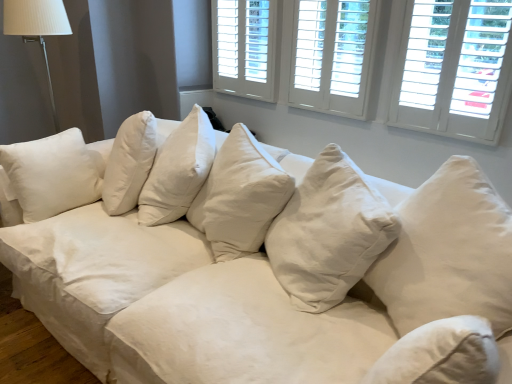
Locate an element on the screen. beige cotton pillow at center is located at coordinates (449, 252).

Identify the location of white wood shutters at upper right, arranged as the third window when viewed from the left. The width and height of the screenshot is (512, 384). (454, 69).

This screenshot has height=384, width=512. Describe the element at coordinates (37, 28) in the screenshot. I see `white fabric lampshade at upper left` at that location.

The height and width of the screenshot is (384, 512). Identify the location of white fabric lampshade at upper left. (37, 28).

Locate an element on the screen. This screenshot has width=512, height=384. white wood shutters at upper center, which appears as the third window when viewed from the right is located at coordinates (245, 47).

You are a GUI agent. You are given a task and a screenshot of the screen. Output one action in this format:
    pyautogui.click(x=<x>, y=<y>)
    Task: Click on the beige cotton pillow at center
    
    Given the screenshot: What is the action you would take?
    pyautogui.click(x=449, y=252)

From a real-world perspective, between white cotton couch at center and beige cotton pillow at center, who is vertically lower?

white cotton couch at center, from a real-world perspective.

Is white cotton couch at center in front of or behind beige cotton pillow at center in the image?

white cotton couch at center is positioned closer to the viewer than beige cotton pillow at center.

Is white cotton couch at center inside the boundaries of beige cotton pillow at center, or outside?

The correct answer is: outside.

In the scene shown: Is white wood shutters at upper right, arranged as the third window when viewed from the left, situated inside beige cotton pillow at center or outside?

white wood shutters at upper right, arranged as the third window when viewed from the left, is located beyond the bounds of beige cotton pillow at center.

Considering the sizes of white wood shutters at upper right, arranged as the 1th window when viewed from the right, and beige cotton pillow at center in the image, is white wood shutters at upper right, arranged as the 1th window when viewed from the right, bigger or smaller than beige cotton pillow at center?

Considering their sizes, white wood shutters at upper right, arranged as the 1th window when viewed from the right, takes up less space than beige cotton pillow at center.

Looking at this image, considering the sizes of white cotton couch at center and white wood shutters at upper right, arranged as the 1th window when viewed from the right, in the image, is white cotton couch at center wider or thinner than white wood shutters at upper right, arranged as the 1th window when viewed from the right,?

In the image, white cotton couch at center appears to be wider than white wood shutters at upper right, arranged as the 1th window when viewed from the right.

How different are the orientations of white cotton couch at center and white wood shutters at upper right, arranged as the 1th window when viewed from the right, in degrees?

The angular difference between white cotton couch at center and white wood shutters at upper right, arranged as the 1th window when viewed from the right, is 4.36 degrees.

From a real-world perspective, is white cotton couch at center physically located above or below white wood shutters at upper right, arranged as the third window when viewed from the left?

From a real-world perspective, white cotton couch at center is physically below white wood shutters at upper right, arranged as the third window when viewed from the left.

Does point (216, 178) come behind point (453, 91)?

No, (216, 178) is closer to viewer.

From the picture: Considering the sizes of beige cotton pillow at center and white fabric lampshade at upper left in the image, is beige cotton pillow at center taller or shorter than white fabric lampshade at upper left?

Considering their sizes, beige cotton pillow at center has less height than white fabric lampshade at upper left.

Is beige cotton pillow at center bigger or smaller than white fabric lampshade at upper left?

Clearly, beige cotton pillow at center is larger in size than white fabric lampshade at upper left.

Image resolution: width=512 pixels, height=384 pixels. What are the coordinates of `table lamp that appears above the beige cotton pillow at center (from the image's perspective)` in the screenshot? It's located at (37, 28).

Can you tell me how much beige cotton pillow at center and white fabric lampshade at upper left differ in facing direction?

beige cotton pillow at center and white fabric lampshade at upper left are facing 30.3 degrees away from each other.

Locate an element on the screen. This screenshot has height=384, width=512. pillow in front of the white wood window at upper center, the 2th window positioned from the left is located at coordinates (449, 252).

Looking at this image, is white wood window at upper center, the second window from the right, positioned behind beige cotton pillow at center?

Yes, white wood window at upper center, the second window from the right, is further from the viewer.

Considering the sizes of white wood window at upper center, the 2th window positioned from the left, and beige cotton pillow at center in the image, is white wood window at upper center, the 2th window positioned from the left, taller or shorter than beige cotton pillow at center?

Clearly, white wood window at upper center, the 2th window positioned from the left, is shorter compared to beige cotton pillow at center.

Can you tell me how much white wood window at upper center, the second window from the right, and beige cotton pillow at center differ in facing direction?

The facing directions of white wood window at upper center, the second window from the right, and beige cotton pillow at center are 31.1 degrees apart.

Between white cotton couch at center and white wood window at upper center, the second window from the right, which one has less height?

With less height is white wood window at upper center, the second window from the right.

Is white cotton couch at center not within white wood window at upper center, the 2th window positioned from the left?

white cotton couch at center lies outside white wood window at upper center, the 2th window positioned from the left,'s area.

Is the surface of white cotton couch at center in direct contact with white wood window at upper center, the second window from the right?

No.

Which window is the 1st one when counting from the back of the white wood shutters at upper right, arranged as the third window when viewed from the left? Please provide its 2D coordinates.

[(333, 55)]

Looking at their sizes, would you say white wood shutters at upper right, arranged as the 1th window when viewed from the right, is wider or thinner than white wood window at upper center, the second window from the right?

white wood shutters at upper right, arranged as the 1th window when viewed from the right, is wider than white wood window at upper center, the second window from the right.

Is white wood shutters at upper right, arranged as the third window when viewed from the left, to the left of white wood window at upper center, the second window from the right, from the viewer's perspective?

No, white wood shutters at upper right, arranged as the third window when viewed from the left, is not to the left of white wood window at upper center, the second window from the right.

Can you tell me how much white wood shutters at upper right, arranged as the third window when viewed from the left, and white wood window at upper center, the 2th window positioned from the left, differ in facing direction?

There is a 3.51-degree angle between the facing directions of white wood shutters at upper right, arranged as the third window when viewed from the left, and white wood window at upper center, the 2th window positioned from the left.

Where is `pillow that appears behind the white cotton couch at center`? pillow that appears behind the white cotton couch at center is located at coordinates (449, 252).

Where is `pillow located underneath the white wood shutters at upper right, arranged as the 1th window when viewed from the right (from a real-world perspective)`? The image size is (512, 384). pillow located underneath the white wood shutters at upper right, arranged as the 1th window when viewed from the right (from a real-world perspective) is located at coordinates (449, 252).

Based on their spatial positions, is white wood window at upper center, the second window from the right, or white cotton couch at center closer to white wood shutters at upper center, which appears as the third window when viewed from the right?

white wood window at upper center, the second window from the right, is closer to white wood shutters at upper center, which appears as the third window when viewed from the right.

Estimate the real-world distances between objects in this image. Which object is closer to white cotton couch at center, beige cotton pillow at center or white wood shutters at upper right, arranged as the 1th window when viewed from the right?

Among the two, beige cotton pillow at center is located nearer to white cotton couch at center.

When comparing their distances from white fabric lampshade at upper left, does white wood window at upper center, the second window from the right, or white wood shutters at upper right, arranged as the 1th window when viewed from the right, seem closer?

white wood window at upper center, the second window from the right, is closer to white fabric lampshade at upper left.

From the image, which object appears to be nearer to white wood window at upper center, the 2th window positioned from the left, white fabric lampshade at upper left or white wood shutters at upper right, arranged as the third window when viewed from the left?

Based on the image, white wood shutters at upper right, arranged as the third window when viewed from the left, appears to be nearer to white wood window at upper center, the 2th window positioned from the left.

From the image, which object appears to be nearer to white wood window at upper center, the 2th window positioned from the left, beige cotton pillow at center or white wood shutters at upper center, which appears as the third window when viewed from the right?

white wood shutters at upper center, which appears as the third window when viewed from the right, is positioned closer to the anchor white wood window at upper center, the 2th window positioned from the left.

From the image, which object appears to be nearer to white cotton couch at center, white wood shutters at upper right, arranged as the third window when viewed from the left, or white wood window at upper center, the second window from the right?

white wood window at upper center, the second window from the right.

From the image, which object appears to be farther from white fabric lampshade at upper left, white wood shutters at upper center, placed as the 1th window when sorted from left to right, or beige cotton pillow at center?

Based on the image, beige cotton pillow at center appears to be further to white fabric lampshade at upper left.

Which object lies further to the anchor point white fabric lampshade at upper left, white wood window at upper center, the 2th window positioned from the left, or white wood shutters at upper center, which appears as the third window when viewed from the right?

white wood window at upper center, the 2th window positioned from the left.

Image resolution: width=512 pixels, height=384 pixels. I want to click on studio couch between white fabric lampshade at upper left and beige cotton pillow at center from left to right, so click(x=252, y=260).

You are a GUI agent. You are given a task and a screenshot of the screen. Output one action in this format:
    pyautogui.click(x=<x>, y=<y>)
    Task: Click on the window between white fabric lampshade at upper left and white wood window at upper center, the 2th window positioned from the left
    The image size is (512, 384).
    Given the screenshot: What is the action you would take?
    pyautogui.click(x=245, y=47)

Find the location of a particular element. The image size is (512, 384). pillow located between white cotton couch at center and white wood shutters at upper center, which appears as the third window when viewed from the right, in the depth direction is located at coordinates (449, 252).

You are a GUI agent. You are given a task and a screenshot of the screen. Output one action in this format:
    pyautogui.click(x=<x>, y=<y>)
    Task: Click on the window between white wood shutters at upper center, placed as the 1th window when sorted from left to right, and white wood shutters at upper right, arranged as the 1th window when viewed from the right, in the horizontal direction
    This screenshot has width=512, height=384.
    Given the screenshot: What is the action you would take?
    pyautogui.click(x=333, y=55)